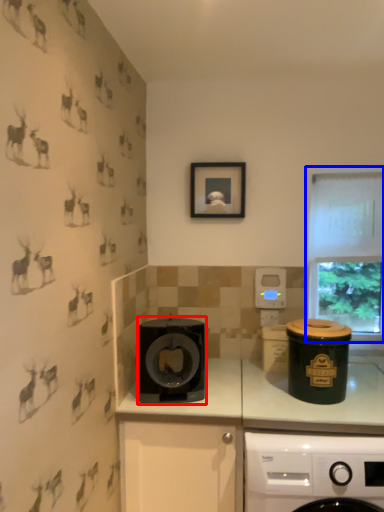
Question: Among these objects, which one is farthest to the camera, kitchen appliance (highlighted by a red box) or window (highlighted by a blue box)?

Choices:
 (A) kitchen appliance
 (B) window

Answer: (B)